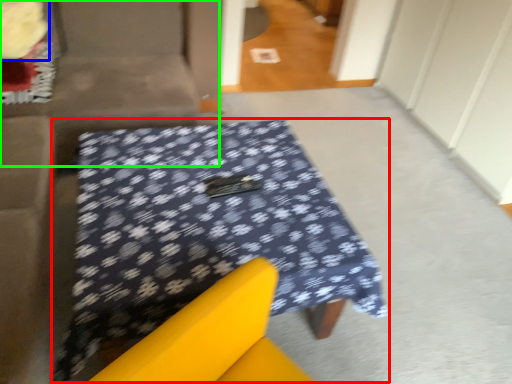
Question: Which object is positioned closest to table (highlighted by a red box)? Select from flower (highlighted by a blue box) and couch (highlighted by a green box).

Choices:
 (A) flower
 (B) couch

Answer: (B)